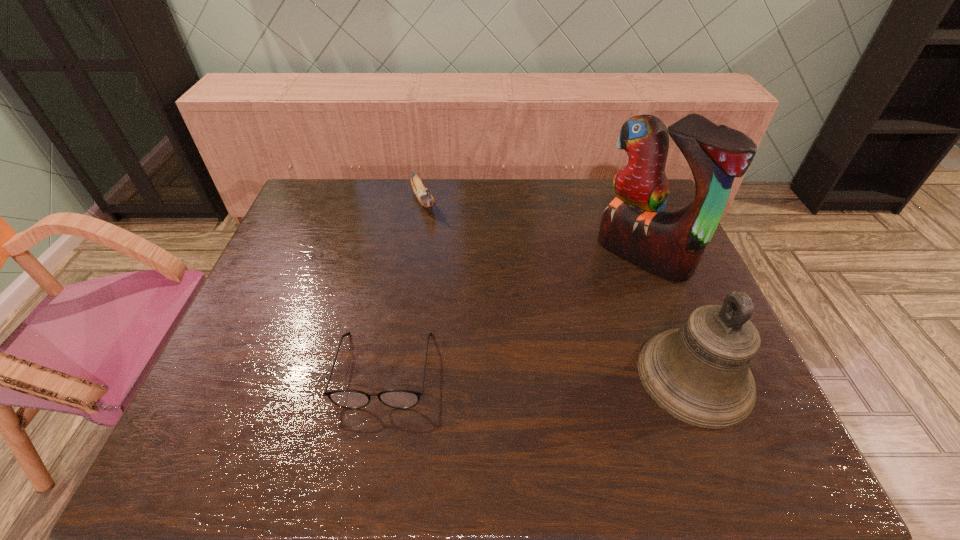
Find the location of a particular element. The height and width of the screenshot is (540, 960). free space on the desktop that is between the shortest object and the bell and is positioned on the peel of the third tallest object is located at coordinates (509, 372).

Locate an element on the screen. The width and height of the screenshot is (960, 540). vacant spot on the desktop that is between the spectacles and the bell and is positioned at the face of the parrot is located at coordinates (508, 372).